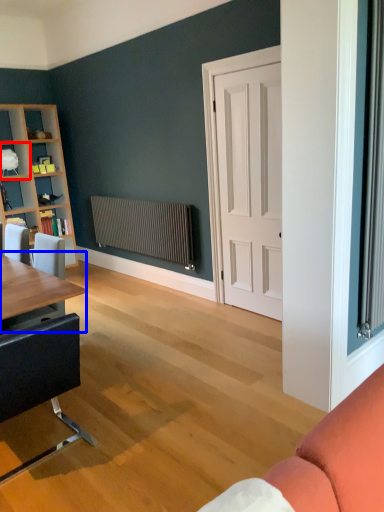
Question: Among these objects, which one is farthest to the camera, shelf (highlighted by a red box) or table (highlighted by a blue box)?

Choices:
 (A) shelf
 (B) table

Answer: (A)